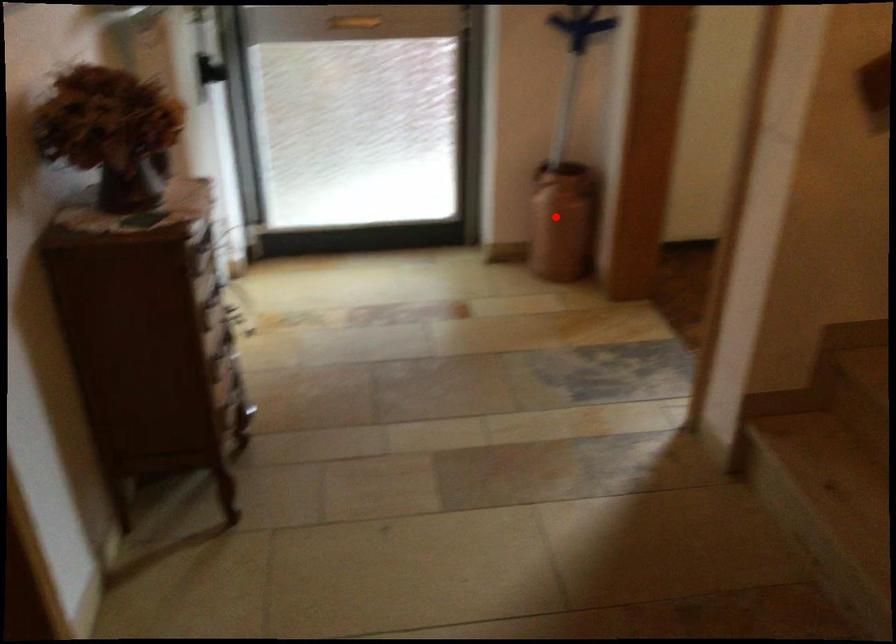
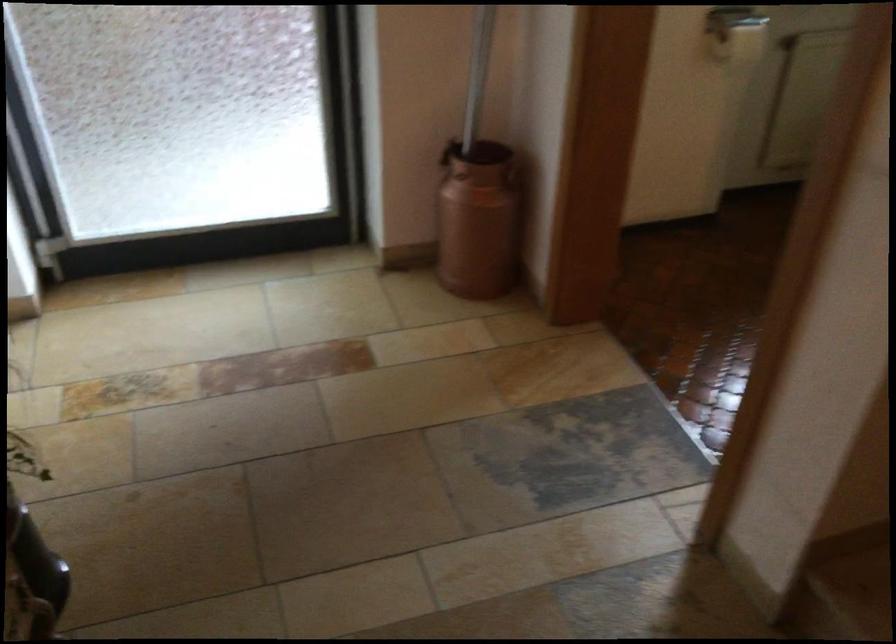
Where in the second image is the point corresponding to the highlighted location from the first image?

(478, 220)